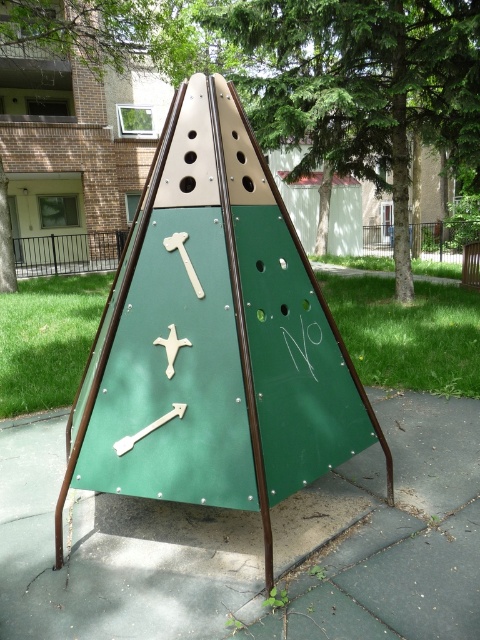
You are a parent supervising children at the playground. You notice the green matte triangle at center and the green rubber pavement at center. Which object would you need to step over if you want to walk around the climbing frame?

The green matte triangle at center is larger in size than the green rubber pavement at center, so you would need to step over the green matte triangle at center when walking around the climbing frame.

You are a parent supervising children playing at the playground. You notice the green matte triangle at center and the green rubber pavement at center. Which object is higher up from the ground?

The green matte triangle at center is taller than the green rubber pavement at center, so the green matte triangle at center is higher up from the ground.

You are a parent standing at the base of the playground structure. Your child wants to reach the highest point of the green matte triangle at center. Considering the structure is 2.40 meters tall, can your child climb it if they are 1.20 meters tall?

The green matte triangle at center is 2.40 meters from camera. Since the child is only 1.20 meters tall, they may struggle to reach the highest point without assistance.